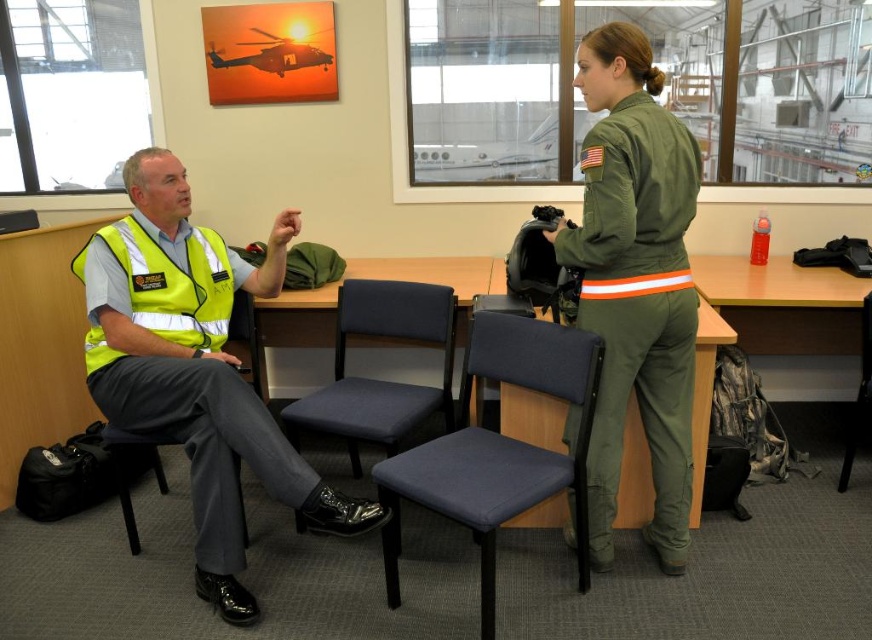
Question: Among these objects, which one is nearest to the camera?

Choices:
 (A) yellow reflective vest at left
 (B) blue fabric chair at center
 (C) green fabric uniform at center

Answer: (C)

Question: Is green fabric uniform at center closer to the viewer compared to blue fabric chair at center?

Choices:
 (A) no
 (B) yes

Answer: (B)

Question: Considering the real-world distances, which object is farthest from the wooden table at center?

Choices:
 (A) dark blue fabric chair at center
 (B) blue fabric chair at center
 (C) green fabric uniform at center
 (D) yellow reflective vest at left

Answer: (C)

Question: Observing the image, what is the correct spatial positioning of yellow reflective vest at left in reference to wooden table at center?

Choices:
 (A) below
 (B) above

Answer: (A)

Question: Is dark blue fabric chair at center below wooden table at center?

Choices:
 (A) no
 (B) yes

Answer: (B)

Question: Which point is closer to the camera?

Choices:
 (A) blue fabric chair at center
 (B) wooden table at center

Answer: (A)